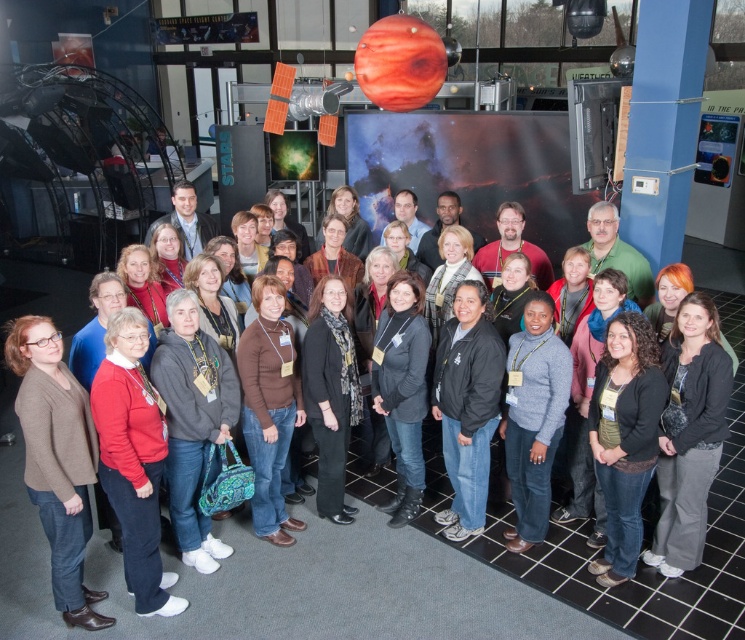
You are an event organizer who needs to arrange seating for a group photo. You notice two individuals wearing a gray fleece sweater at center and a black leather jacket at center. Which person should you seat in a wider chair to accommodate their clothing?

The gray fleece sweater at center requires a wider chair since its width is larger than the black leather jacket at center.

You are standing at the entrance of the science center and want to find the brown wool sweater at center. According to the floor plan, your current position is at point 0.0. Which direction should you move to locate it?

The brown wool sweater at center is located at point 0.884, so you should move forward towards increasing coordinates to reach it.

You are an organizer at the science center and need to arrange the participants for a group photo. The brown wool sweater at center and the black leather jacket at center are overlapping. Which clothing item should you adjust to ensure both are visible in the photo?

The brown wool sweater at center is positioned over the black leather jacket at center, so you should adjust the brown wool sweater at center to move it slightly to reveal the black leather jacket at center.